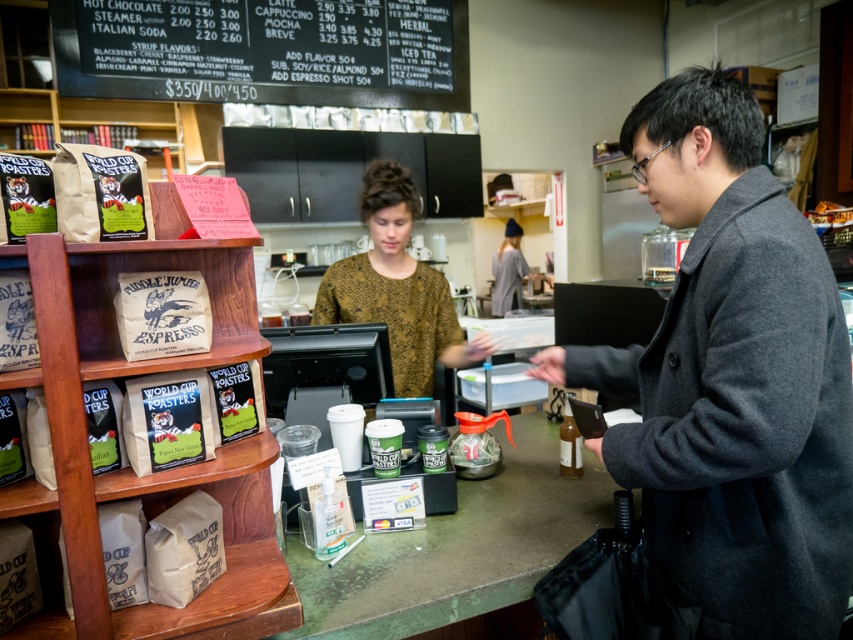
Does dark gray wool coat at center right have a lesser height compared to blackboard menu at upper center?

In fact, dark gray wool coat at center right may be taller than blackboard menu at upper center.

Who is more distant from viewer, (x=776, y=602) or (x=166, y=70)?

Positioned behind is point (x=166, y=70).

Where is `dark gray wool coat at center right`? This screenshot has width=853, height=640. dark gray wool coat at center right is located at coordinates (732, 378).

Does blackboard menu at upper center lie in front of brown textured blouse at center?

That is False.

Who is more distant from viewer, (x=419, y=13) or (x=425, y=340)?

The point (x=419, y=13) is more distant.

Is point (277, 92) in front of point (440, 340)?

No, it is behind (440, 340).

Find the location of a particular element. This screenshot has width=853, height=640. blackboard menu at upper center is located at coordinates (265, 51).

What do you see at coordinates (732, 378) in the screenshot? This screenshot has height=640, width=853. I see `dark gray wool coat at center right` at bounding box center [732, 378].

Who is lower down, dark gray wool coat at center right or green matte counter at center?

green matte counter at center is below.

Measure the distance between point (697, 593) and camera.

Point (697, 593) and camera are 3.63 feet apart from each other.

Image resolution: width=853 pixels, height=640 pixels. Find the location of `dark gray wool coat at center right`. dark gray wool coat at center right is located at coordinates (732, 378).